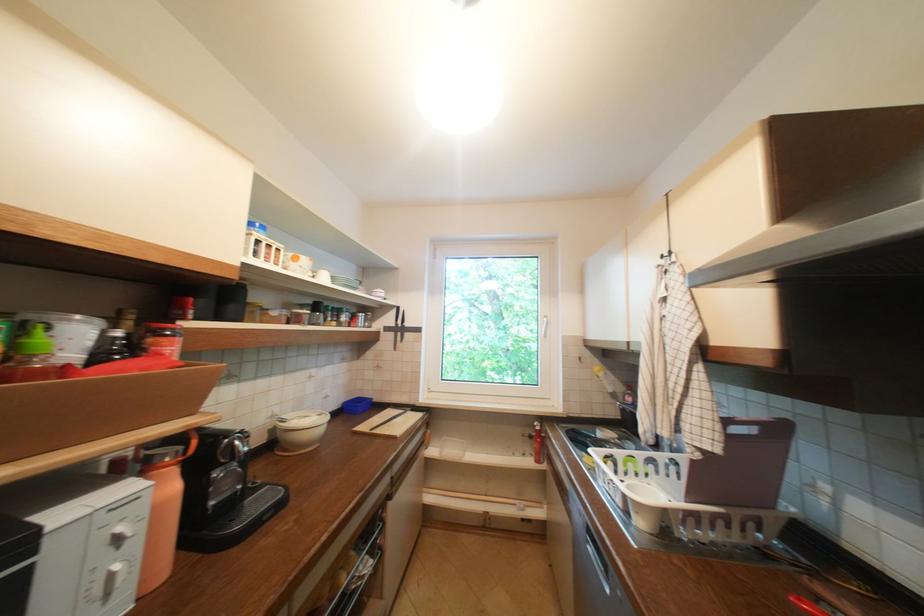
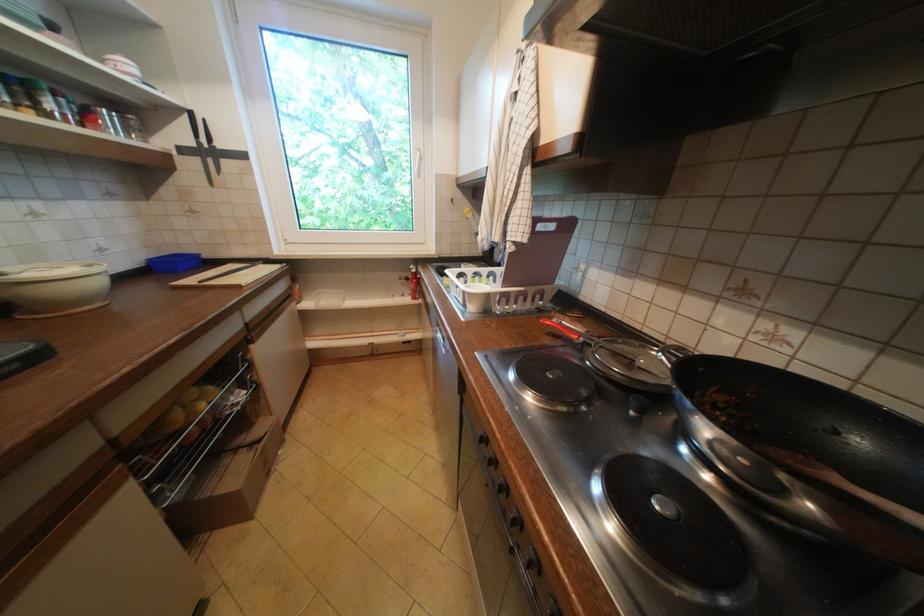
Find the pixel in the second image that matches [326,416] in the first image.

(91, 267)